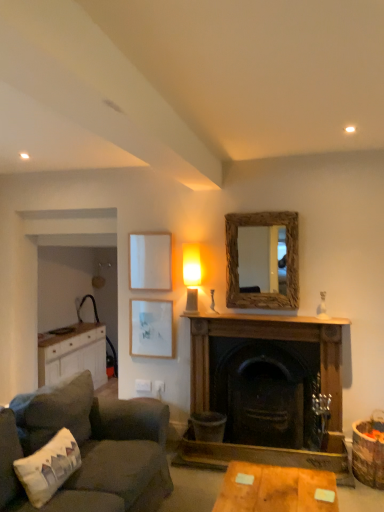
Identify the location of vacant space situated above wooden table at lower center (from a real-world perspective). The height and width of the screenshot is (512, 384). (282, 492).